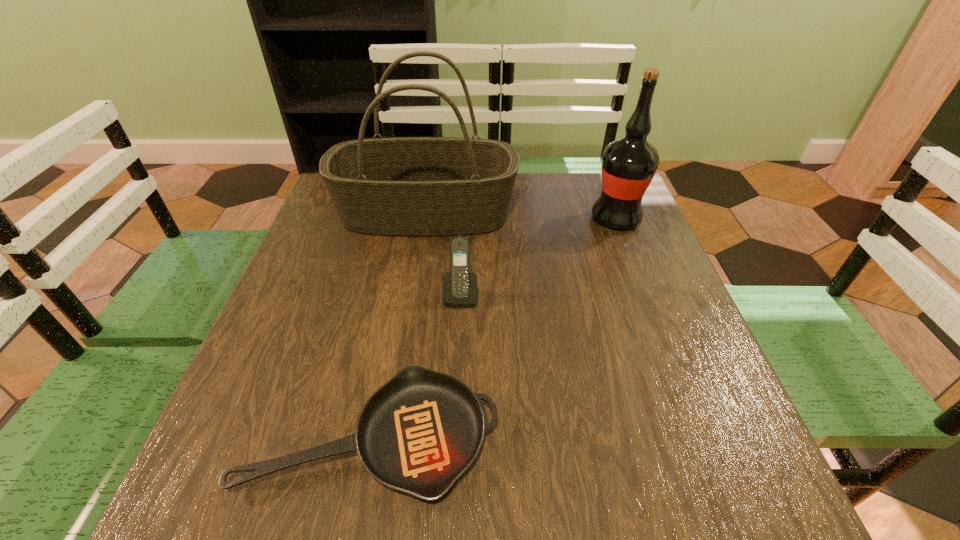
The width and height of the screenshot is (960, 540). I want to click on the rightmost object, so click(629, 164).

Find the location of a particular element. The image size is (960, 540). basket is located at coordinates (399, 186).

You are a GUI agent. You are given a task and a screenshot of the screen. Output one action in this format:
    pyautogui.click(x=<x>, y=<y>)
    Task: Click on the third farthest object
    Image resolution: width=960 pixels, height=540 pixels.
    Given the screenshot: What is the action you would take?
    pyautogui.click(x=459, y=285)

Find the location of a particular element. This screenshot has height=540, width=960. the third tallest object is located at coordinates (459, 285).

At what (x,y) coordinates should I click in order to perform the action: click on the shortest object. Please return your answer as a coordinate pair (x, y). The width and height of the screenshot is (960, 540). Looking at the image, I should click on (418, 433).

The image size is (960, 540). Identify the location of the nearest object. (418, 433).

You are a GUI agent. You are given a task and a screenshot of the screen. Output one action in this format:
    pyautogui.click(x=<x>, y=<y>)
    Task: Click on the blank area located on the front of the rightmost object
    The width and height of the screenshot is (960, 540).
    Given the screenshot: What is the action you would take?
    pyautogui.click(x=668, y=354)

Identify the location of free space located on the right of the basket. (572, 213).

This screenshot has width=960, height=540. I want to click on vacant space located 0.310m on the front-facing side of the third farthest object, so click(454, 449).

Where is `free space located on the back of the frying pan`? free space located on the back of the frying pan is located at coordinates (398, 299).